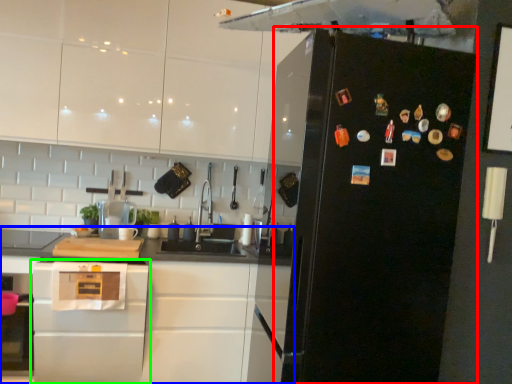
Question: Which is farther away from refrigerator (highlighted by a red box)? cabinetry (highlighted by a blue box) or home appliance (highlighted by a green box)?

Choices:
 (A) cabinetry
 (B) home appliance

Answer: (B)